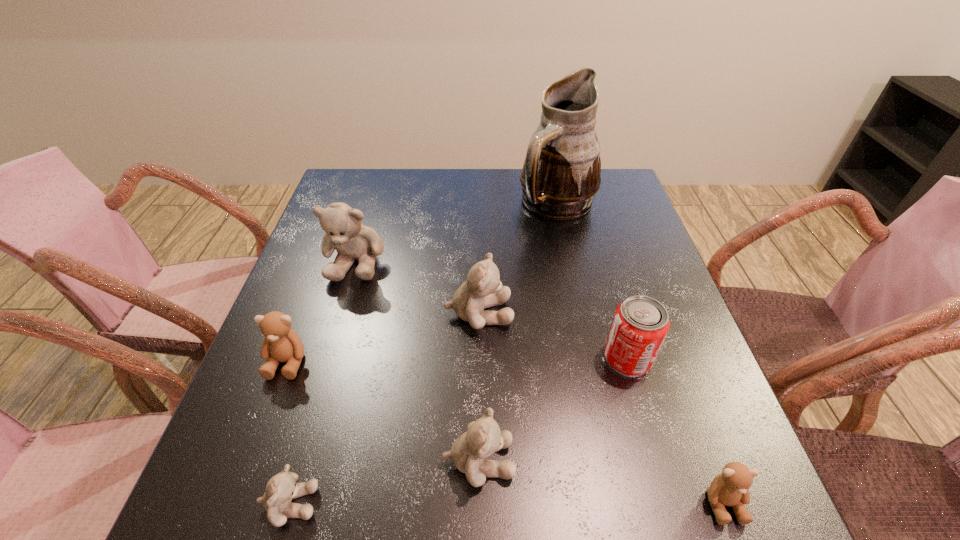
You are a GUI agent. You are given a task and a screenshot of the screen. Output one action in this format:
    pyautogui.click(x=<x>, y=<y>)
    Task: Click on the rightmost teddy bear
    
    Given the screenshot: What is the action you would take?
    pyautogui.click(x=730, y=488)

This screenshot has height=540, width=960. I want to click on the rightmost object, so click(x=730, y=488).

Locate an element on the screen. The image size is (960, 540). the smallest gray teddy bear is located at coordinates (280, 490).

Identify the location of free space located from the spout of the brown pitcher. The width and height of the screenshot is (960, 540). (587, 338).

Identify the location of vacant region located on the face of the farthest gray teddy bear. (306, 423).

Locate an element on the screen. The image size is (960, 540). vacant space located 0.220m on the face of the second farthest teddy bear is located at coordinates (612, 313).

Identify the location of vacant region located on the left of the can. (509, 358).

The height and width of the screenshot is (540, 960). Identify the location of vacant space situated 0.080m on the front-facing side of the fourth nearest teddy bear. (265, 420).

The height and width of the screenshot is (540, 960). Identify the location of vacant point located on the face of the third biggest gray teddy bear. pyautogui.click(x=677, y=461).

Image resolution: width=960 pixels, height=540 pixels. Identify the location of vacant space located 0.320m on the face of the smallest gray teddy bear. (524, 503).